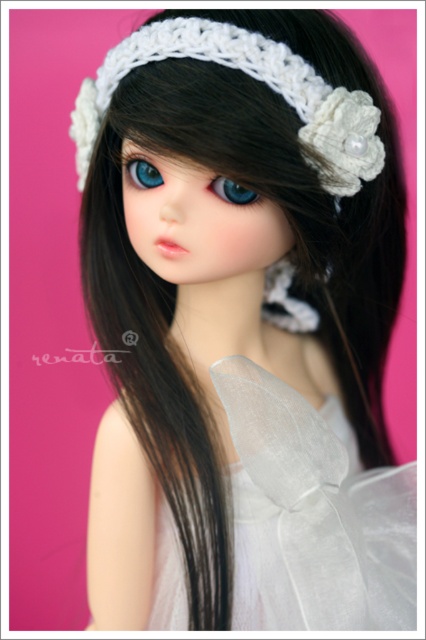
Question: Is translucent white fabric at center closer to the viewer compared to blue glossy eye at center?

Choices:
 (A) yes
 (B) no

Answer: (A)

Question: Which point appears closest to the camera in this image?

Choices:
 (A) (229, 182)
 (B) (95, 96)
 (C) (146, 180)
 (D) (224, 380)

Answer: (D)

Question: Does translucent white fabric at center come behind white crochet headband at upper center?

Choices:
 (A) no
 (B) yes

Answer: (A)

Question: Is white crochet headband at upper center further to camera compared to blue glossy eye at upper center?

Choices:
 (A) no
 (B) yes

Answer: (A)

Question: Which object appears farthest from the camera in this image?

Choices:
 (A) blue glossy eye at center
 (B) blue glossy eye at upper center

Answer: (B)

Question: Which point is farther from the camera taking this photo?

Choices:
 (A) (95, 112)
 (B) (296, 394)
 (C) (253, 193)

Answer: (A)